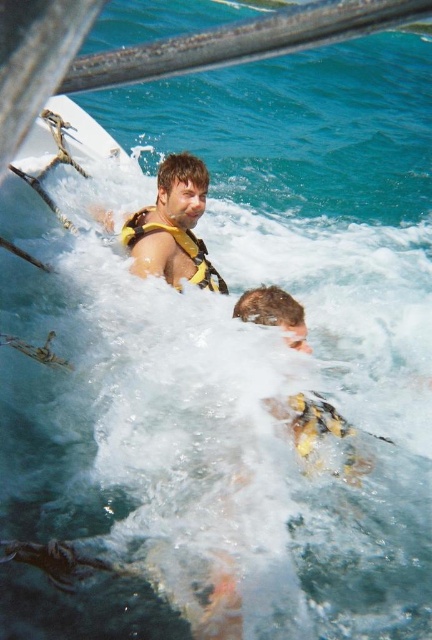
You are a lifeguard observing the scene. You notice two individuals participating in a water activity. Which individual is wearing the yellow life vest at upper center?

The yellow life vest at upper center is located at point [172,227], so the individual in the foreground is wearing the yellow life vest at upper center.